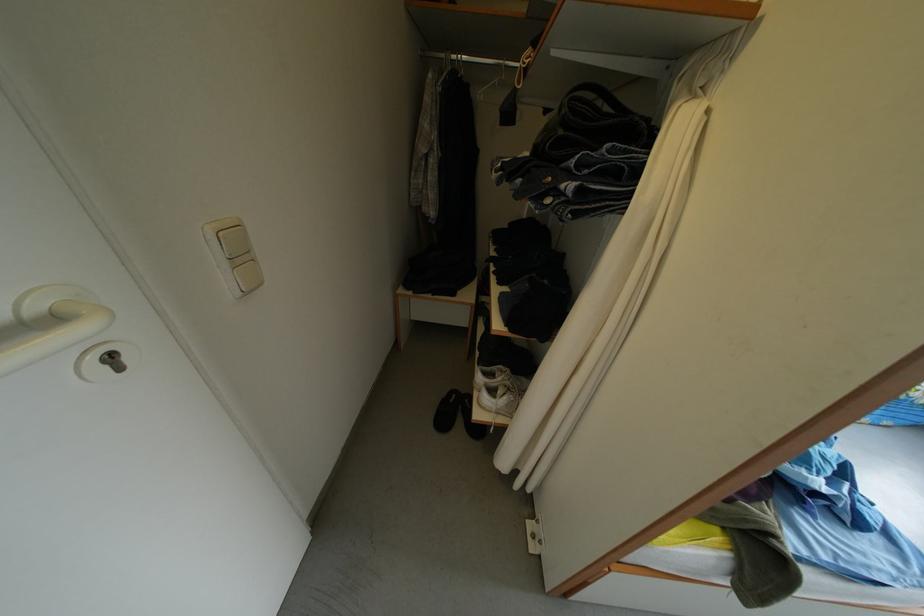
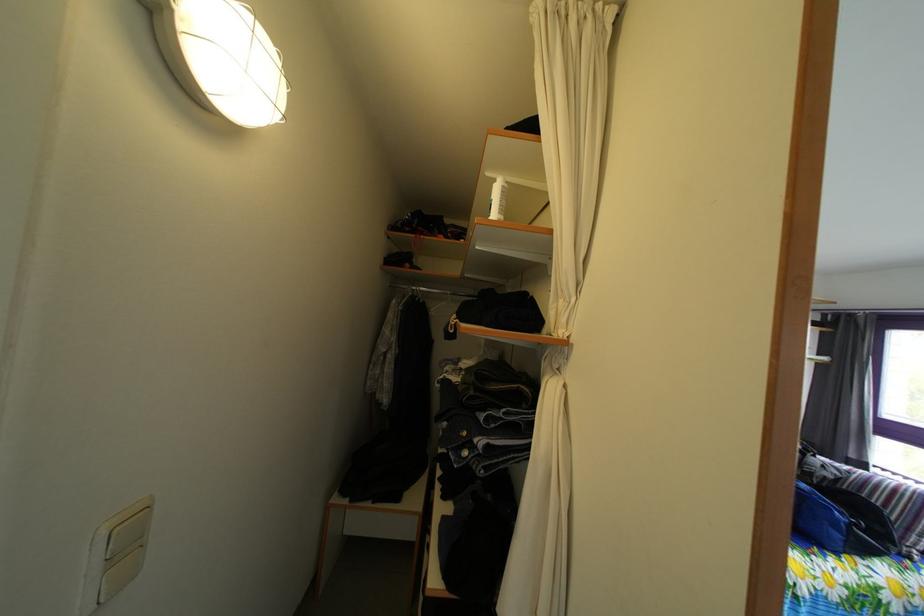
Where in the second image is the point corresponding to (x=662, y=156) from the first image?

(545, 416)